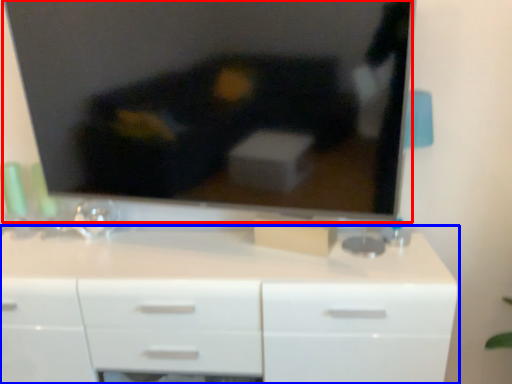
Question: Which point is further to the camera, television (highlighted by a red box) or chest of drawers (highlighted by a blue box)?

Choices:
 (A) television
 (B) chest of drawers

Answer: (B)